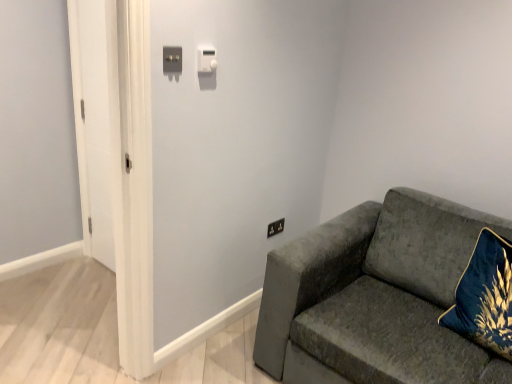
What is the approximate width of satin silver switch at upper center, the 1th light switch positioned from the left?

satin silver switch at upper center, the 1th light switch positioned from the left, is 0.94 inches in width.

This screenshot has height=384, width=512. What do you see at coordinates (275, 227) in the screenshot?
I see `black plastic electrical outlet at upper right` at bounding box center [275, 227].

The image size is (512, 384). In order to click on black plastic electrical outlet at upper right in this screenshot , I will do `click(275, 227)`.

This screenshot has height=384, width=512. What do you see at coordinates (485, 296) in the screenshot?
I see `velvet blue pillow at right` at bounding box center [485, 296].

This screenshot has height=384, width=512. Identify the location of velvet gray couch at right. (376, 297).

What is the approximate width of white glossy door at left?

white glossy door at left is 2.63 inches in width.

The width and height of the screenshot is (512, 384). What are the coordinates of `white plastic light switch at upper center, placed as the 1th light switch when sorted from back to front` in the screenshot? It's located at [x=206, y=59].

Is velvet gray couch at right in front of satin silver switch at upper center, which is the second light switch in back-to-front order?

Yes, velvet gray couch at right is closer to the viewer.

From the image's perspective, is velvet gray couch at right below satin silver switch at upper center, which is the 1th light switch from front to back?

Indeed, from the image's perspective, velvet gray couch at right is shown beneath satin silver switch at upper center, which is the 1th light switch from front to back.

Would you consider velvet gray couch at right to be distant from satin silver switch at upper center, which is the second light switch in back-to-front order?

Absolutely, velvet gray couch at right is distant from satin silver switch at upper center, which is the second light switch in back-to-front order.

Can you confirm if velvet gray couch at right is bigger than satin silver switch at upper center, which is the 1th light switch from front to back?

Correct, velvet gray couch at right is larger in size than satin silver switch at upper center, which is the 1th light switch from front to back.

Which is more to the left, white glossy door at left or satin silver switch at upper center, the 1th light switch positioned from the left?

From the viewer's perspective, white glossy door at left appears more on the left side.

From the image's perspective, does white glossy door at left appear higher than satin silver switch at upper center, which is the second light switch in back-to-front order?

No.

Would you say white glossy door at left is inside or outside satin silver switch at upper center, which appears as the 2th light switch when viewed from the right?

white glossy door at left is spatially situated outside satin silver switch at upper center, which appears as the 2th light switch when viewed from the right.

Is white glossy door at left with satin silver switch at upper center, the 1th light switch positioned from the left?

No, white glossy door at left is not making contact with satin silver switch at upper center, the 1th light switch positioned from the left.

Is satin silver switch at upper center, which is the 1th light switch from front to back, looking in the opposite direction of black plastic electrical outlet at upper right?

No, satin silver switch at upper center, which is the 1th light switch from front to back, is not facing the opposite direction of black plastic electrical outlet at upper right.

From a real-world perspective, which is physically above, satin silver switch at upper center, which appears as the 2th light switch when viewed from the right, or black plastic electrical outlet at upper right?

In real-world perspective, satin silver switch at upper center, which appears as the 2th light switch when viewed from the right, is above.

Considering the sizes of objects satin silver switch at upper center, which is the second light switch in back-to-front order, and black plastic electrical outlet at upper right in the image provided, who is thinner, satin silver switch at upper center, which is the second light switch in back-to-front order, or black plastic electrical outlet at upper right?

Thinner between the two is satin silver switch at upper center, which is the second light switch in back-to-front order.

What's the angular difference between satin silver switch at upper center, which is the 1th light switch from front to back, and black plastic electrical outlet at upper right's facing directions?

The facing directions of satin silver switch at upper center, which is the 1th light switch from front to back, and black plastic electrical outlet at upper right are 0.691 degrees apart.

From a real-world perspective, which is physically below, black plastic electrical outlet at upper right or white plastic light switch at upper center, which appears as the first light switch when viewed from the right?

black plastic electrical outlet at upper right, from a real-world perspective.

Considering the sizes of objects black plastic electrical outlet at upper right and white plastic light switch at upper center, which appears as the first light switch when viewed from the right, in the image provided, who is wider, black plastic electrical outlet at upper right or white plastic light switch at upper center, which appears as the first light switch when viewed from the right,?

With larger width is white plastic light switch at upper center, which appears as the first light switch when viewed from the right.

Is white plastic light switch at upper center, placed as the 1th light switch when sorted from back to front, a part of black plastic electrical outlet at upper right?

That's incorrect, white plastic light switch at upper center, placed as the 1th light switch when sorted from back to front, is not inside black plastic electrical outlet at upper right.

Which of these two, velvet blue pillow at right or satin silver switch at upper center, the 1th light switch positioned from the left, is bigger?

Bigger between the two is velvet blue pillow at right.

From the image's perspective, which one is positioned lower, velvet blue pillow at right or satin silver switch at upper center, which is the second light switch in back-to-front order?

velvet blue pillow at right is shown below in the image.

Does satin silver switch at upper center, which is the 1th light switch from front to back, have a smaller size compared to white plastic light switch at upper center, placed as the 1th light switch when sorted from back to front?

Yes.

From the picture: Which object is positioned more to the right, satin silver switch at upper center, the 1th light switch positioned from the left, or white plastic light switch at upper center, placed as the 1th light switch when sorted from back to front?

white plastic light switch at upper center, placed as the 1th light switch when sorted from back to front, is more to the right.

Is satin silver switch at upper center, which is the second light switch in back-to-front order, placed right next to white plastic light switch at upper center, which is the second light switch in front-to-back order?

satin silver switch at upper center, which is the second light switch in back-to-front order, and white plastic light switch at upper center, which is the second light switch in front-to-back order, are clearly separated.

Consider the image. Could you tell me if satin silver switch at upper center, which is the second light switch in back-to-front order, is facing white plastic light switch at upper center, which is the second light switch in front-to-back order?

No, satin silver switch at upper center, which is the second light switch in back-to-front order, is not oriented towards white plastic light switch at upper center, which is the second light switch in front-to-back order.

Which is more to the left, white glossy door at left or black plastic electrical outlet at upper right?

white glossy door at left.

Is white glossy door at left closer to camera compared to black plastic electrical outlet at upper right?

Yes, it is in front of black plastic electrical outlet at upper right.

Is white glossy door at left taller or shorter than black plastic electrical outlet at upper right?

Clearly, white glossy door at left is taller compared to black plastic electrical outlet at upper right.

Where is `studio couch lying on the right of satin silver switch at upper center, which appears as the 2th light switch when viewed from the right`? This screenshot has width=512, height=384. studio couch lying on the right of satin silver switch at upper center, which appears as the 2th light switch when viewed from the right is located at coordinates (376, 297).

Locate an element on the screen. The height and width of the screenshot is (384, 512). glass door that is behind the satin silver switch at upper center, which is the 1th light switch from front to back is located at coordinates (95, 118).

Estimate the real-world distances between objects in this image. Which object is further from velvet gray couch at right, velvet blue pillow at right or black plastic electrical outlet at upper right?

black plastic electrical outlet at upper right.

From the image, which object appears to be farther from satin silver switch at upper center, which is the second light switch in back-to-front order, white glossy door at left or white plastic light switch at upper center, which appears as the first light switch when viewed from the right?

Based on the image, white glossy door at left appears to be further to satin silver switch at upper center, which is the second light switch in back-to-front order.

Based on their spatial positions, is black plastic electrical outlet at upper right or velvet gray couch at right further from satin silver switch at upper center, which is the second light switch in back-to-front order?

velvet gray couch at right is positioned further to the anchor satin silver switch at upper center, which is the second light switch in back-to-front order.

Based on their spatial positions, is black plastic electrical outlet at upper right or satin silver switch at upper center, the 1th light switch positioned from the left, further from velvet blue pillow at right?

satin silver switch at upper center, the 1th light switch positioned from the left, is further to velvet blue pillow at right.

From the image, which object appears to be nearer to white glossy door at left, satin silver switch at upper center, which is the second light switch in back-to-front order, or white plastic light switch at upper center, which is the second light switch in front-to-back order?

white plastic light switch at upper center, which is the second light switch in front-to-back order.

Based on their spatial positions, is white plastic light switch at upper center, placed as the 2th light switch when sorted from left to right, or satin silver switch at upper center, which is the 1th light switch from front to back, further from velvet gray couch at right?

satin silver switch at upper center, which is the 1th light switch from front to back, is further to velvet gray couch at right.

When comparing their distances from velvet blue pillow at right, does white plastic light switch at upper center, which appears as the first light switch when viewed from the right, or velvet gray couch at right seem further?

The object further to velvet blue pillow at right is white plastic light switch at upper center, which appears as the first light switch when viewed from the right.

Which object lies further to the anchor point velvet blue pillow at right, satin silver switch at upper center, the 1th light switch positioned from the left, or black plastic electrical outlet at upper right?

satin silver switch at upper center, the 1th light switch positioned from the left, is further to velvet blue pillow at right.

At what (x,y) coordinates should I click in order to perform the action: click on electric outlet between white glossy door at left and velvet gray couch at right. Please return your answer as a coordinate pair (x, y). The image size is (512, 384). Looking at the image, I should click on (275, 227).

Locate an element on the screen. The image size is (512, 384). studio couch situated between white plastic light switch at upper center, placed as the 1th light switch when sorted from back to front, and velvet blue pillow at right from left to right is located at coordinates (376, 297).

Identify the location of light switch located between satin silver switch at upper center, the 1th light switch positioned from the left, and velvet blue pillow at right in the left-right direction. (206, 59).

Locate an element on the screen. This screenshot has width=512, height=384. electric outlet between white plastic light switch at upper center, which is the second light switch in front-to-back order, and velvet blue pillow at right is located at coordinates (275, 227).